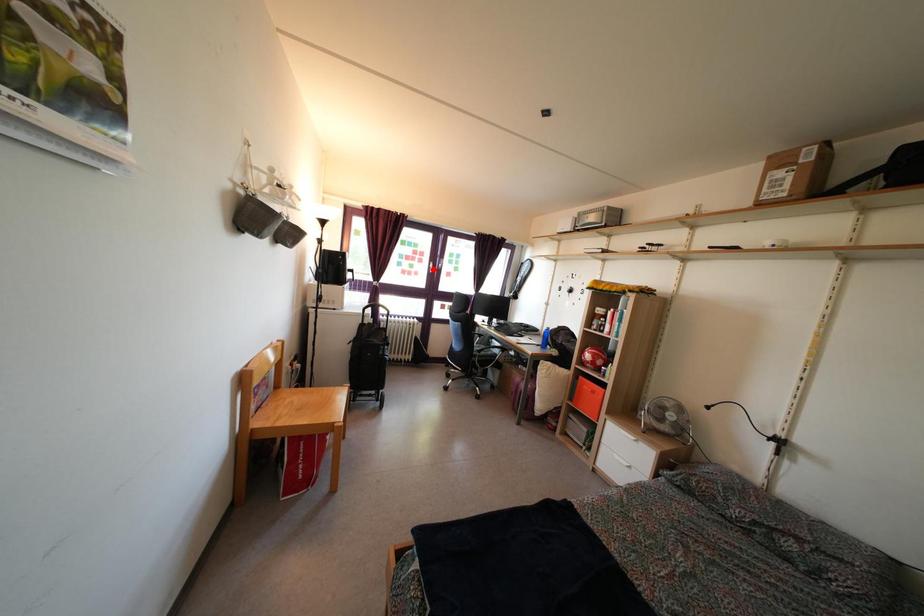
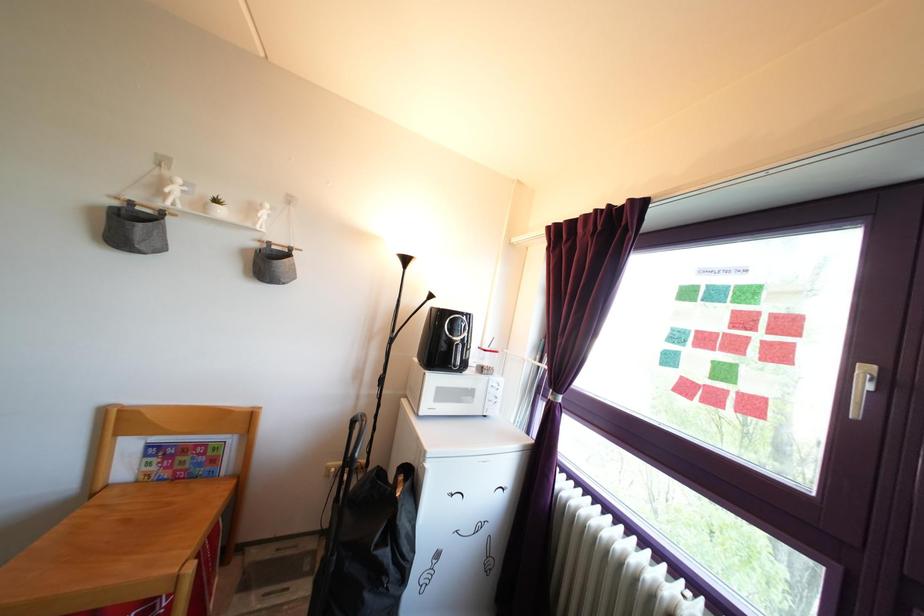
Locate, in the second image, the point that corresponds to the highlighted location in the first image.

(857, 365)